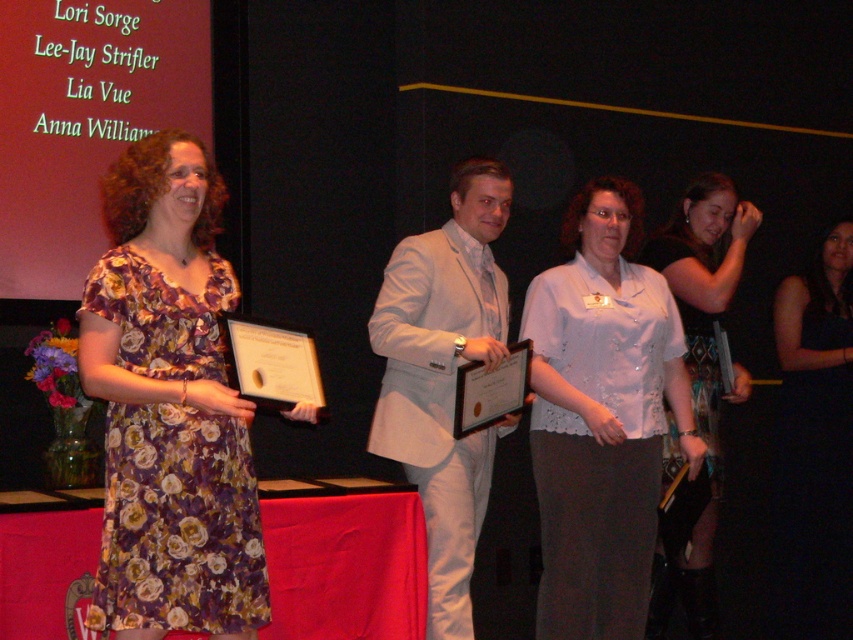
You are attending an awards ceremony and notice two people on stage. One is wearing a floral dress at left and the other a white lace blouse at center. From your perspective in the audience, which person is positioned to the right?

The white lace blouse at center is positioned to the right of the floral dress at left.

What is located at the coordinates point [601,417]?

The white lace blouse at center is located at point [601,417].

You are organizing a photoshoot and need to determine which clothing item takes up more visual space in the image. Based on the scene description, which item is larger between the white lace blouse at center and the black satin dress at center?

The white lace blouse at center is larger in size than the black satin dress at center, so the white lace blouse at center takes up more visual space in the image.